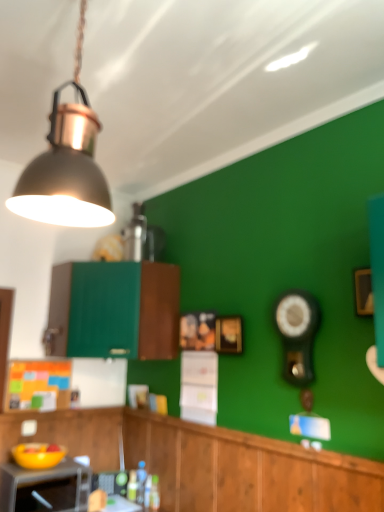
Question: In terms of size, does black glossy clock at right appear bigger or smaller than translucent plastic bottle at lower center?

Choices:
 (A) big
 (B) small

Answer: (A)

Question: Is point (289, 369) closer or farther from the camera than point (140, 484)?

Choices:
 (A) farther
 (B) closer

Answer: (B)

Question: Considering the real-world distances, which object is closest to the black glossy clock at right?

Choices:
 (A) wooden cabinet at lower center, which appears as the 2th cabinetry when viewed from the top
 (B) matte black microwave at lower left
 (C) gold metallic picture frame at center
 (D) translucent plastic bottle at lower center
 (E) metallic gray lampshade at upper left

Answer: (C)

Question: Based on their relative distances, which object is nearer to the black glossy clock at right?

Choices:
 (A) wooden cabinet at lower center, which appears as the 2th cabinetry when viewed from the top
 (B) metallic gray lampshade at upper left
 (C) green matte cabinet at center, marked as the first cabinetry in a top-to-bottom arrangement
 (D) translucent plastic bottle at lower center
 (E) gold metallic picture frame at center

Answer: (E)